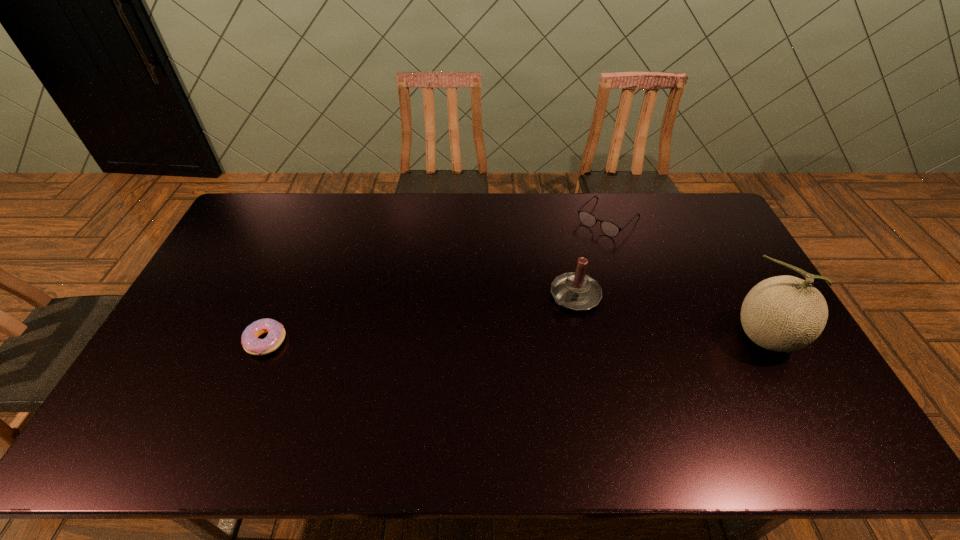
Image resolution: width=960 pixels, height=540 pixels. I want to click on vacant space on the desktop that is between the leftmost object and the cantaloup and is positioned on the front-facing side of the farthest object, so click(x=493, y=339).

This screenshot has height=540, width=960. I want to click on free space on the desktop that is between the shortest object and the tallest object and is positioned on the side of the candle with the handle loop, so click(520, 339).